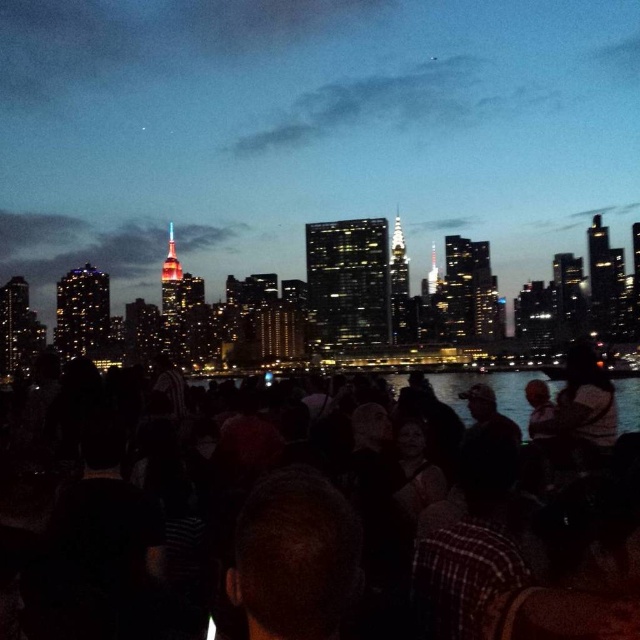
Question: Is transparent water at center positioned behind black matte crowd at center?

Choices:
 (A) no
 (B) yes

Answer: (B)

Question: Can you confirm if transparent water at center is wider than black matte crowd at center?

Choices:
 (A) yes
 (B) no

Answer: (B)

Question: Which object appears farthest from the camera in this image?

Choices:
 (A) black matte crowd at center
 (B) transparent water at center

Answer: (B)

Question: Does transparent water at center have a smaller size compared to black matte crowd at center?

Choices:
 (A) no
 (B) yes

Answer: (B)